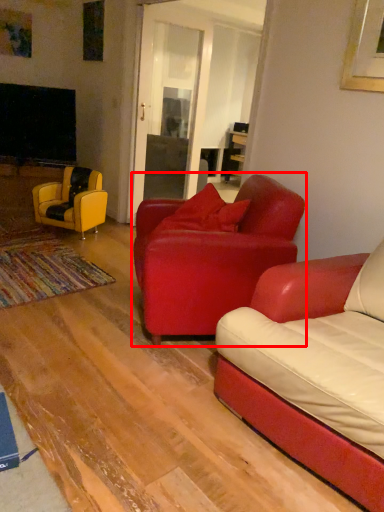
Question: From the image's perspective, where is chair (annotated by the red box) located relative to chair?

Choices:
 (A) above
 (B) below

Answer: (B)